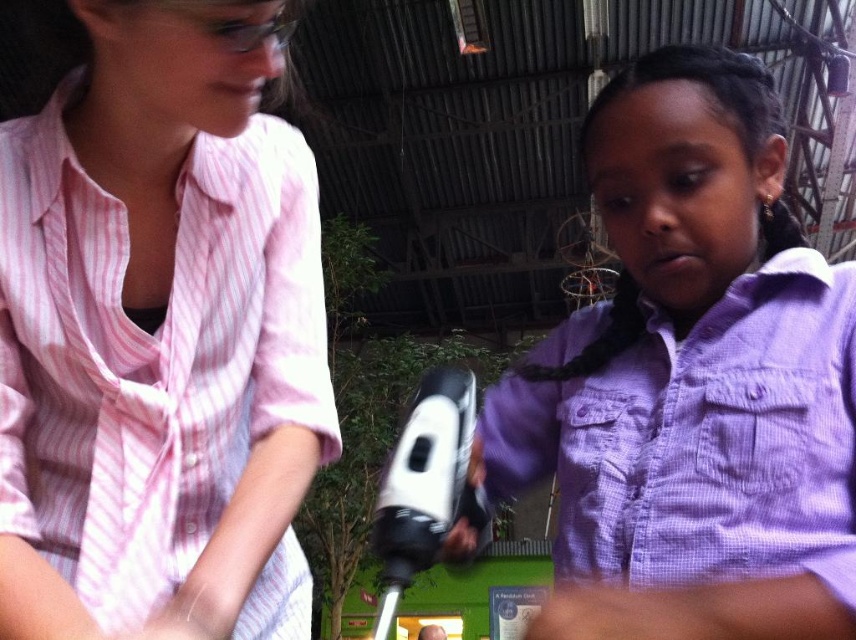
Question: Among these objects, which one is farthest from the camera?

Choices:
 (A) pink striped shirt at upper left
 (B) purple checkered shirt at center
 (C) purple silky hair at center

Answer: (C)

Question: Which is farther from the pink striped shirt at upper left?

Choices:
 (A) purple silky hair at center
 (B) purple checkered shirt at center

Answer: (A)

Question: Can you confirm if pink striped shirt at upper left is positioned to the right of purple checkered shirt at center?

Choices:
 (A) yes
 (B) no

Answer: (B)

Question: Where is purple checkered shirt at center located in relation to purple silky hair at center in the image?

Choices:
 (A) left
 (B) right

Answer: (A)

Question: Which of the following is the farthest from the observer?

Choices:
 (A) purple checkered shirt at center
 (B) pink striped shirt at upper left

Answer: (B)

Question: Where is pink striped shirt at upper left located in relation to purple silky hair at center in the image?

Choices:
 (A) right
 (B) left

Answer: (B)